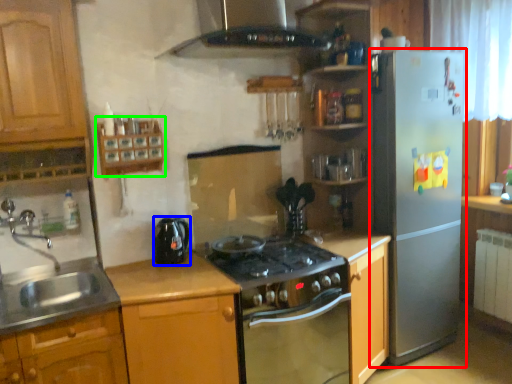
Question: Based on their relative distances, which object is farther from refrigerator (highlighted by a red box)? Choose from kitchen appliance (highlighted by a blue box) and shelf (highlighted by a green box).

Choices:
 (A) kitchen appliance
 (B) shelf

Answer: (B)